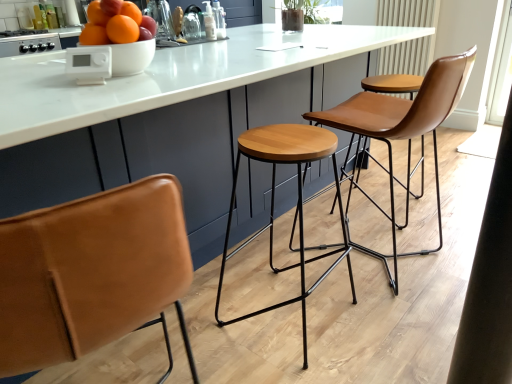
Question: Is point (142, 64) positioned closer to the camera than point (87, 82)?

Choices:
 (A) closer
 (B) farther

Answer: (B)

Question: From their relative heights in the image, would you say white matte bowl at upper center is taller or shorter than white plastic device at upper center, positioned as the second appliance in left-to-right order?

Choices:
 (A) short
 (B) tall

Answer: (B)

Question: Estimate the real-world distances between objects in this image. Which object is farther from the shiny orange fruits at upper left?

Choices:
 (A) white plastic device at upper center, the 1th appliance positioned from the bottom
 (B) white glossy stove at upper left, positioned as the 1th appliance in top-to-bottom order
 (C) white marble table at center
 (D) white matte bowl at upper center
 (E) brown leather chair at center

Answer: (B)

Question: Which of these objects is positioned closest to the white marble table at center?

Choices:
 (A) wooden stool at center
 (B) white matte bowl at upper center
 (C) white textured radiator at upper right
 (D) white glossy stove at upper left, placed as the 2th appliance when sorted from front to back
 (E) shiny orange fruits at upper left

Answer: (E)